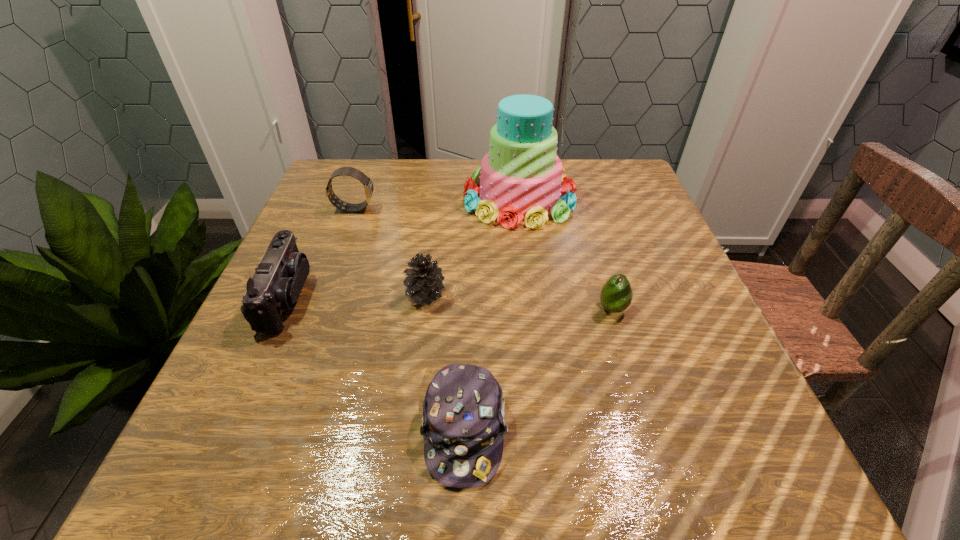
Where is `vacant space located on the left of the avocado`? The width and height of the screenshot is (960, 540). vacant space located on the left of the avocado is located at coordinates (457, 309).

What are the coordinates of `cake present at the far edge` in the screenshot? It's located at (520, 177).

Identify the location of watch that is at the far edge. (x=348, y=171).

In order to click on object at the near edge in this screenshot , I will do `click(463, 417)`.

Find the location of `watch located in the left edge section of the desktop`. watch located in the left edge section of the desktop is located at coordinates (348, 171).

This screenshot has height=540, width=960. In order to click on camcorder present at the left edge in this screenshot , I will do `click(277, 282)`.

Identify the location of object located at the right edge. (616, 295).

Image resolution: width=960 pixels, height=540 pixels. I want to click on object that is positioned at the far left corner, so click(x=348, y=171).

The width and height of the screenshot is (960, 540). In order to click on free region at the far edge of the desktop in this screenshot , I will do `click(440, 192)`.

The width and height of the screenshot is (960, 540). I want to click on vacant space at the near edge of the desktop, so click(x=324, y=442).